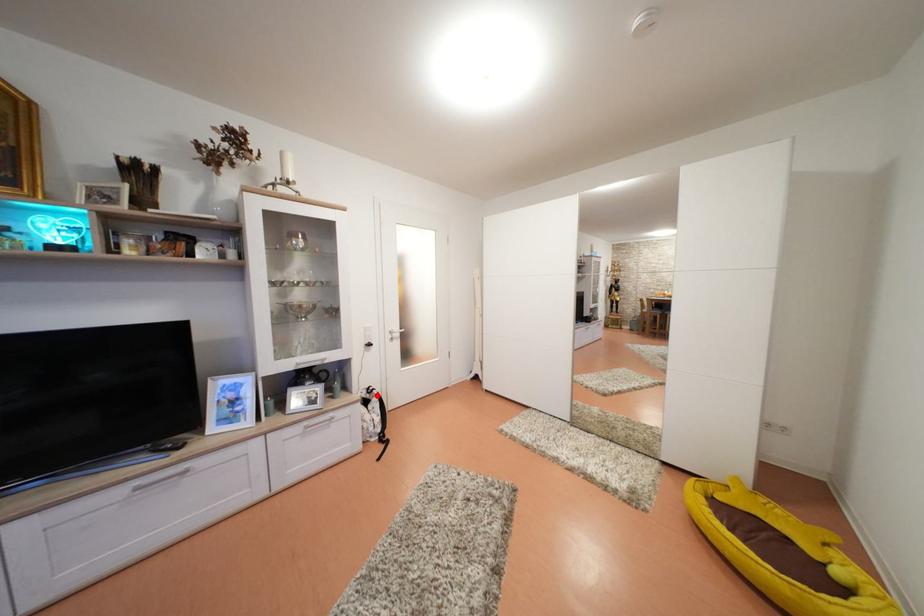
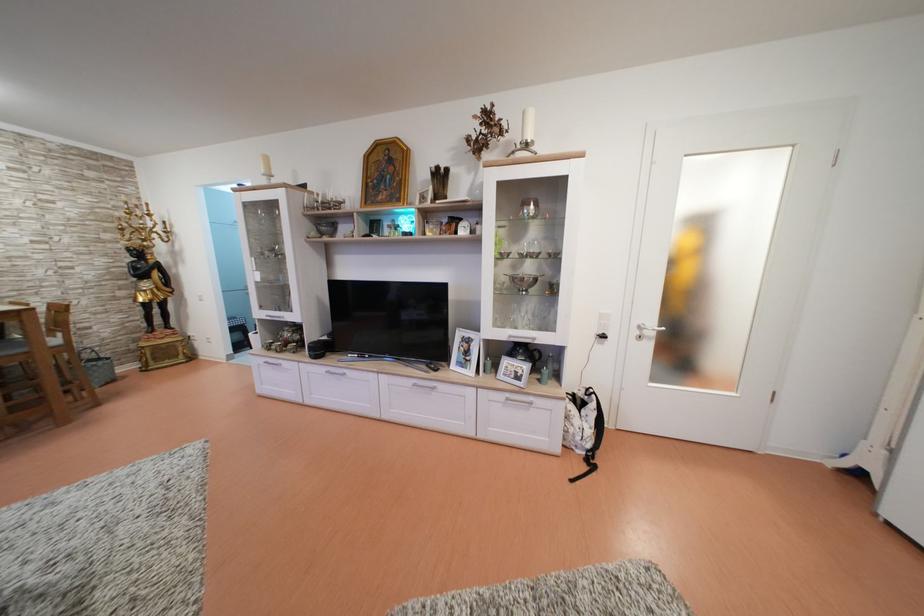
In the second image, find the point that corresponds to the highlighted location in the first image.

(596, 398)